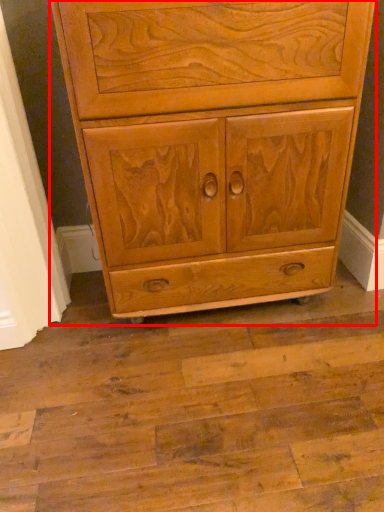
Question: From the image, what is the correct spatial relationship of chest of drawers (annotated by the red box) in relation to screen door?

Choices:
 (A) right
 (B) left

Answer: (A)